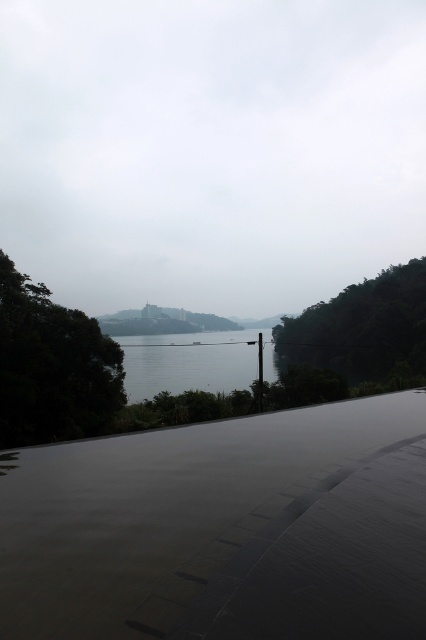
You are standing at the point with coordinates point (310,326) and want to walk to the point with coordinates point (2,364). According to the image, which direction should you face to walk towards your destination?

You should face downward because point (2,364) is in front of point (310,326).

You are an architect designing a new garden. You have two elements to place in your design based on the scene you observed. The elements are the green matte tree at right and the clear water at center. Which element should you make larger in your design to maintain the scene proportions?

The green matte tree at right should be made larger than the clear water at center in the design to maintain the scene proportions since the green matte tree at right is larger in size than clear water at center in the original scene.